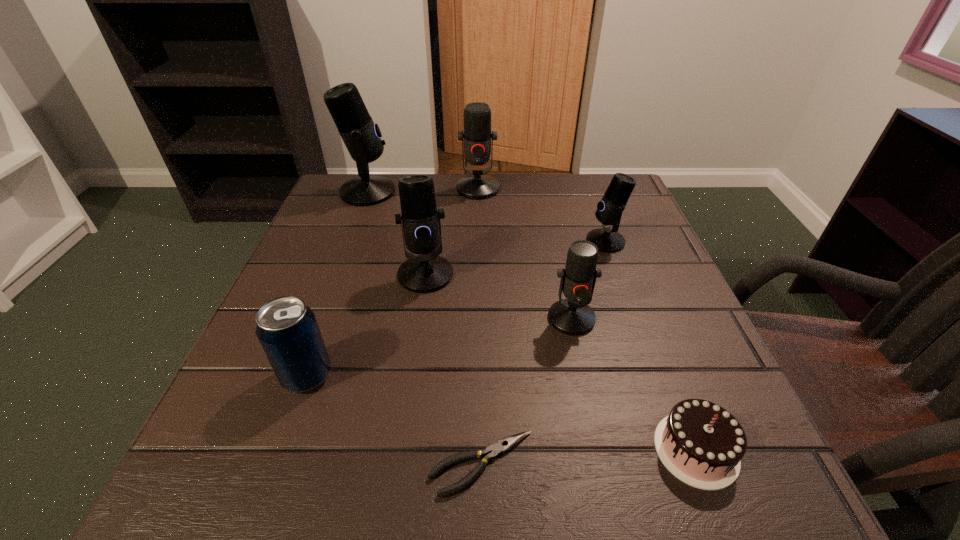
This screenshot has height=540, width=960. Find the location of `vacant space in between the second shortest object and the second black microphone from left to right`. vacant space in between the second shortest object and the second black microphone from left to right is located at coordinates (561, 362).

Locate an element on the screen. The width and height of the screenshot is (960, 540). free space between the sixth farthest object and the nearest microphone is located at coordinates (439, 347).

The height and width of the screenshot is (540, 960). I want to click on free area in between the biggest black microphone and the third object from right to left, so click(469, 255).

Identify the location of vacant region between the fifth farthest object and the biggest black microphone. This screenshot has width=960, height=540. (469, 255).

Locate an element on the screen. The height and width of the screenshot is (540, 960). vacant space in between the second black microphone from left to right and the second shortest object is located at coordinates (561, 362).

At what (x,y) coordinates should I click in order to perform the action: click on unoccupied position between the shortest object and the third farthest object. Please return your answer as a coordinate pair (x, y). The height and width of the screenshot is (540, 960). Looking at the image, I should click on (543, 352).

Find the location of a particular element. The image size is (960, 540). empty space that is in between the second shortest object and the farthest black microphone is located at coordinates (532, 321).

The image size is (960, 540). I want to click on the third closest object to the tallest object, so click(287, 329).

You are a GUI agent. You are given a task and a screenshot of the screen. Output one action in this format:
    pyautogui.click(x=<x>, y=<y>)
    Task: Click on the object that is the second closest one to the smallest black microphone
    The width and height of the screenshot is (960, 540).
    Given the screenshot: What is the action you would take?
    pyautogui.click(x=477, y=135)

Identify which microphone is located as the nearest to the shortest object. Please provide its 2D coordinates. Your answer should be formatted as a tuple, i.e. [(x, y)], where the tuple contains the x and y coordinates of a point satisfying the conditions above.

[(572, 316)]